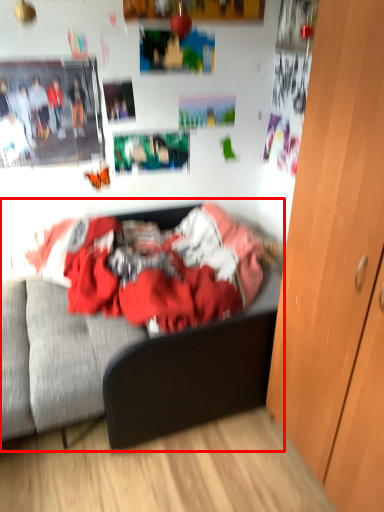
Question: Considering the relative positions of bed (annotated by the red box) and cabinetry in the image provided, where is bed (annotated by the red box) located with respect to the staircase?

Choices:
 (A) left
 (B) right

Answer: (A)